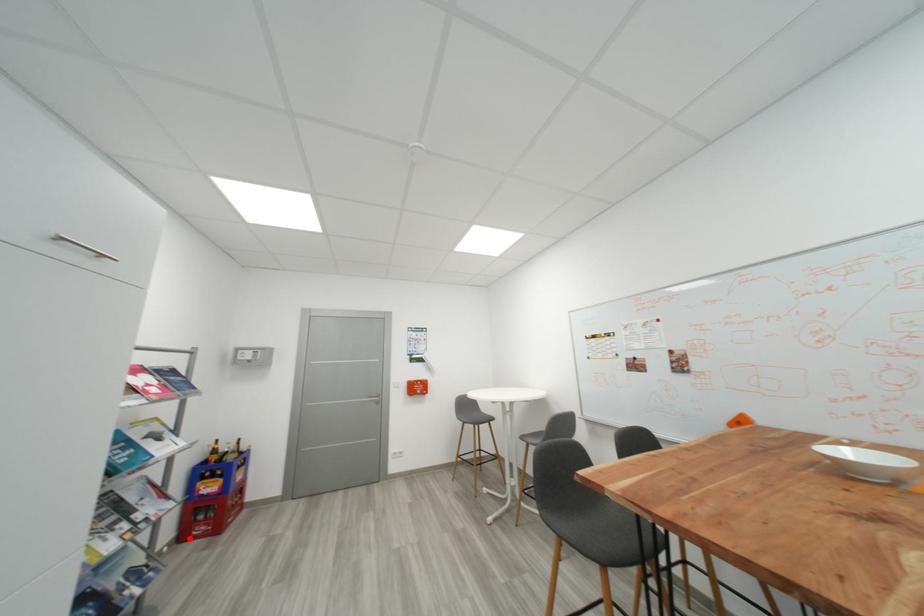
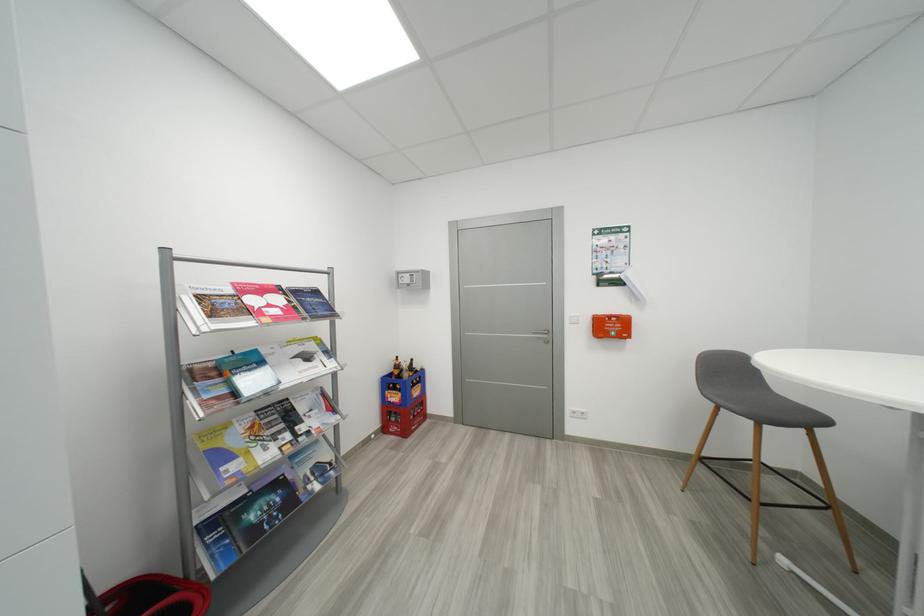
Locate, in the second image, the point that corresponds to the highlighted location in the first image.

(392, 431)